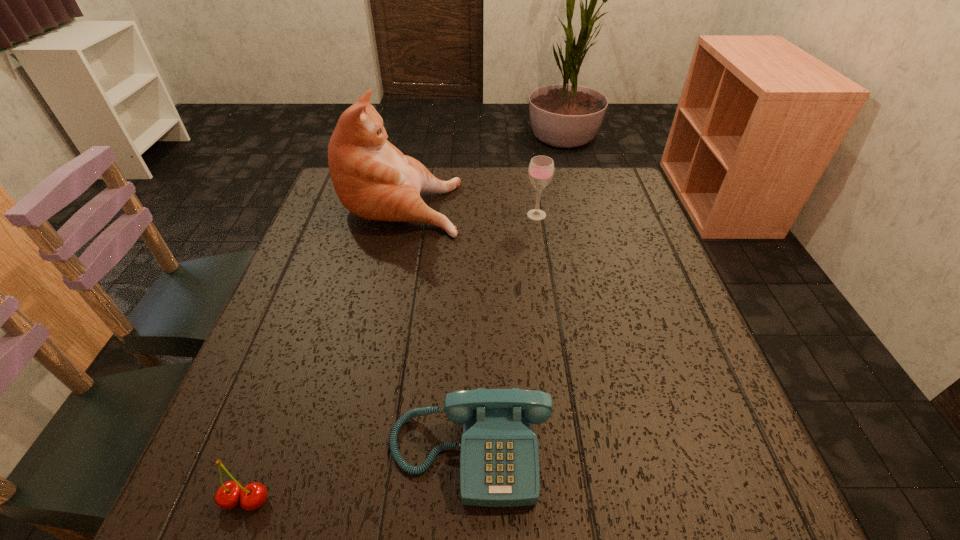
This screenshot has height=540, width=960. Identify the location of object that is the third nearest to the tallest object. (230, 494).

Image resolution: width=960 pixels, height=540 pixels. In order to click on vacant position in the image that satisfies the following two spatial constraints: 1. on the face of the tallest object; 2. on the left side of the wineglass in this screenshot , I will do 399,215.

Find the location of a particular element. The image size is (960, 540). vacant space that satisfies the following two spatial constraints: 1. on the face of the cat; 2. on the back side of the wineglass is located at coordinates (399, 215).

Where is `free location that satisfies the following two spatial constraints: 1. on the face of the tallest object; 2. with the stems of the cherry pointing upwards`? The width and height of the screenshot is (960, 540). free location that satisfies the following two spatial constraints: 1. on the face of the tallest object; 2. with the stems of the cherry pointing upwards is located at coordinates (336, 500).

The image size is (960, 540). Identify the location of vacant space that satisfies the following two spatial constraints: 1. on the face of the tallest object; 2. on the back side of the wineglass. (399, 215).

The width and height of the screenshot is (960, 540). What are the coordinates of `vacant space that satisfies the following two spatial constraints: 1. on the face of the cat; 2. on the back side of the second tallest object` in the screenshot? It's located at (399, 215).